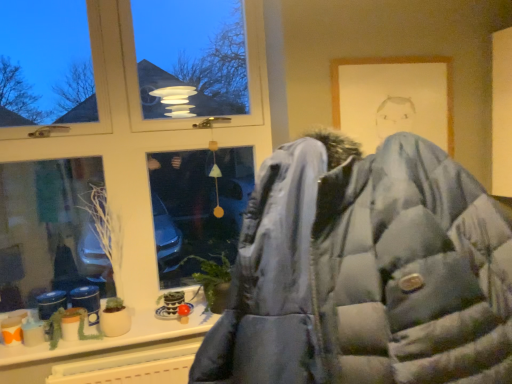
Question: From a real-world perspective, is green matte plant at lower left, which is the 2th plant from top to bottom, positioned above or below white matte plant at lower left, the 2th plant ordered from the bottom?

Choices:
 (A) below
 (B) above

Answer: (A)

Question: Is point (58, 309) positioned closer to the camera than point (109, 253)?

Choices:
 (A) closer
 (B) farther

Answer: (A)

Question: Which object is the closest to the white matte plant at lower left, the 2th plant ordered from the bottom?

Choices:
 (A) yellow plastic radiator at lower center
 (B) green matte plant at lower left, which is the 2th plant from top to bottom
 (C) matte white window at center

Answer: (B)

Question: Considering the real-world distances, which object is closest to the green matte plant at lower left, which is the 2th plant from top to bottom?

Choices:
 (A) matte white window at center
 (B) white matte plant at lower left, the 1th plant positioned from the top
 (C) yellow plastic radiator at lower center

Answer: (C)